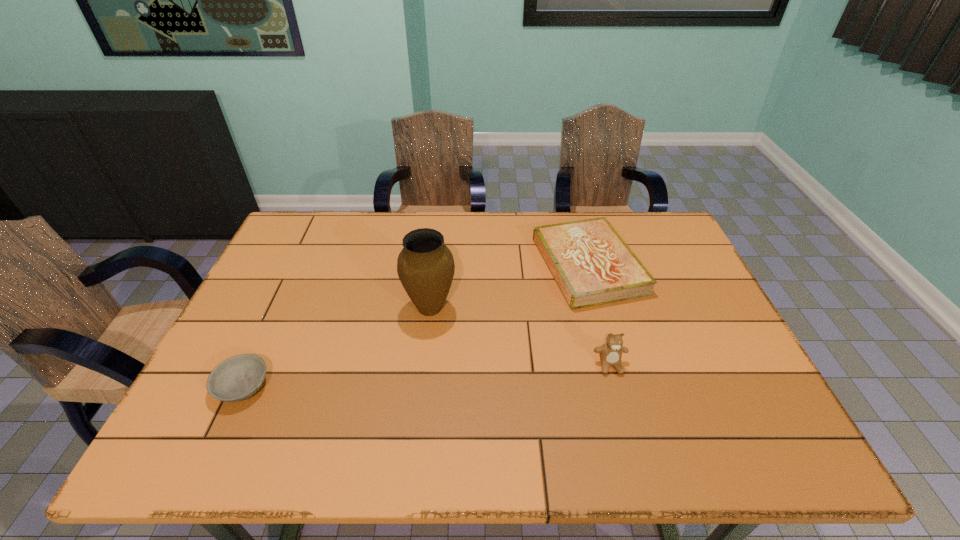
Identify the location of the tallest object. The height and width of the screenshot is (540, 960). (425, 266).

Locate an element on the screen. Image resolution: width=960 pixels, height=540 pixels. urn is located at coordinates (425, 266).

This screenshot has height=540, width=960. I want to click on the third shortest object, so click(x=610, y=353).

This screenshot has width=960, height=540. In order to click on hardback book in this screenshot , I will do `click(592, 265)`.

I want to click on the leftmost object, so click(x=237, y=378).

I want to click on the shortest object, so 237,378.

Identify the location of free space located on the left of the third object from right to left. The image size is (960, 540). (314, 307).

This screenshot has width=960, height=540. Find the location of `free space located 0.070m on the front-facing side of the teddy bear`. free space located 0.070m on the front-facing side of the teddy bear is located at coordinates (620, 402).

Where is `vacant space located 0.140m on the left of the third tallest object`? Image resolution: width=960 pixels, height=540 pixels. vacant space located 0.140m on the left of the third tallest object is located at coordinates (491, 265).

You are a GUI agent. You are given a task and a screenshot of the screen. Output one action in this format:
    pyautogui.click(x=<x>, y=<y>)
    Task: Click on the free space located on the back of the bowl
    
    Given the screenshot: What is the action you would take?
    pyautogui.click(x=277, y=310)